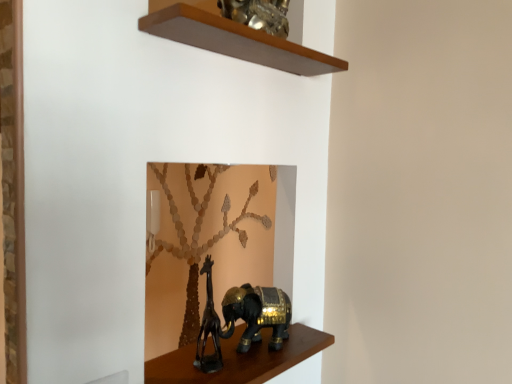
This screenshot has height=384, width=512. What are the coordinates of `vacant space situated above shiny black elephant at lower center, which is the 1th shelf in bottom-to-top order (from a real-world perspective)` in the screenshot? It's located at (253, 357).